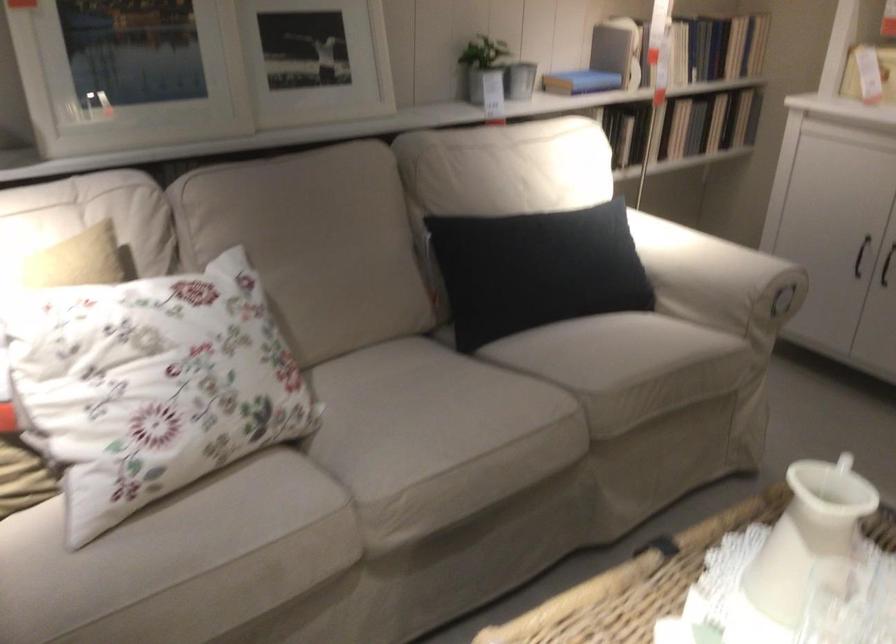
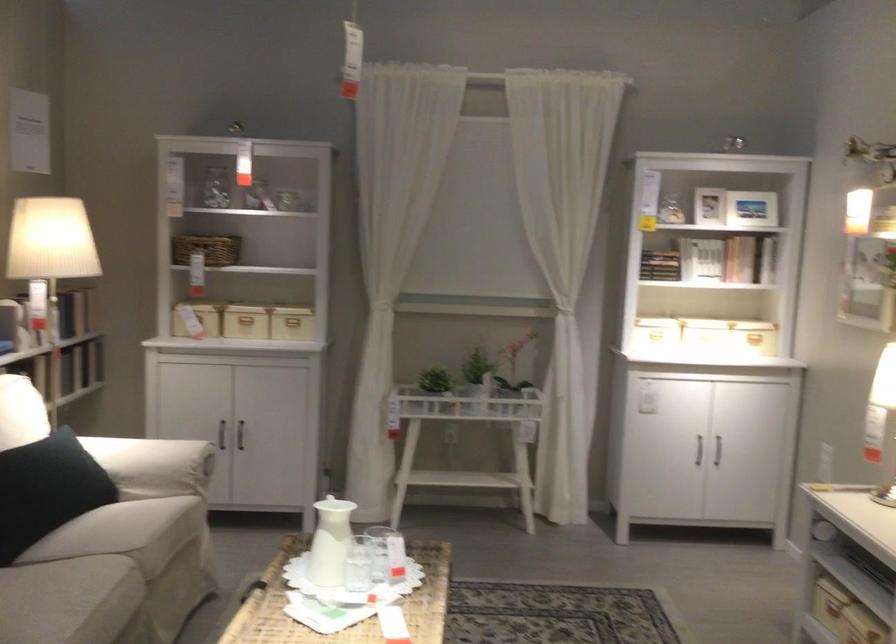
Locate, in the second image, the point that corresponds to pixel 702 270 in the first image.

(152, 465)